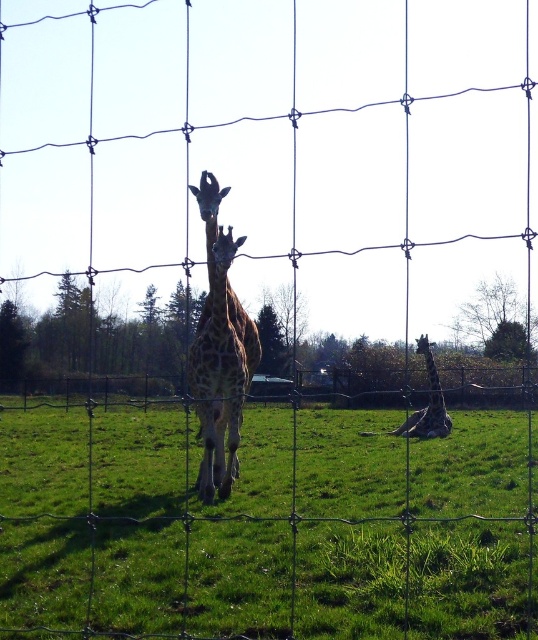
You are a wildlife photographer aiming to capture a closeup shot of the giraffes. You have a camera with a 30cm lens. The fence has gaps that are 25cm wide. Considering the distance between the two giraffes, can you fit the lens through the fence gaps to take a photo of both the spotted fur giraffe at center and the spotted fur giraffe at lower right?

The spotted fur giraffe at center is thinner than the spotted fur giraffe at lower right. Since the fence gaps are 25cm wide and the lens is 30cm, the lens cannot fit through the gaps. Therefore, you cannot take a photo of either giraffe through the fence.

You are a photographer trying to capture a clear photo of the spotted fur giraffe at center. However, the green grass at center is blocking your view. How can you adjust your position to avoid the obstruction?

The green grass at center is located below the spotted fur giraffe at center, so you can lower your camera angle or move to a lower position to avoid the obstruction caused by the green grass at center.